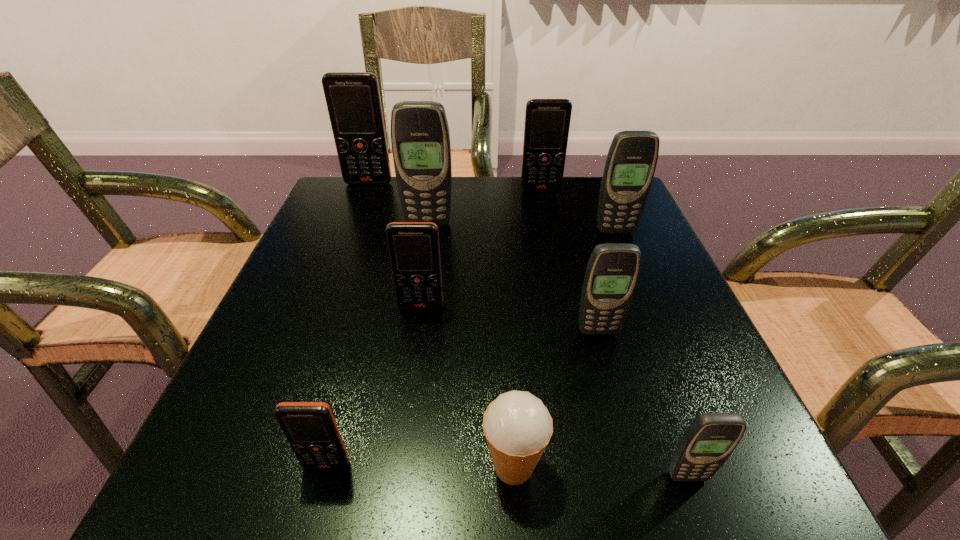
This screenshot has width=960, height=540. In order to click on blank space located on the screen of the fifth farthest object in this screenshot , I will do `click(397, 472)`.

Identify the location of blank space located 0.150m on the back of the icecream. The height and width of the screenshot is (540, 960). (507, 352).

In order to click on icecream present at the near edge in this screenshot , I will do `click(517, 426)`.

Identify the location of object that is at the far left corner. (353, 100).

This screenshot has height=540, width=960. I want to click on object that is at the near left corner, so click(x=310, y=427).

You are a GUI agent. You are given a task and a screenshot of the screen. Output one action in this format:
    pyautogui.click(x=<x>, y=<y>)
    Task: Click on the object present at the far right corner
    The image size is (960, 540).
    Given the screenshot: What is the action you would take?
    pyautogui.click(x=631, y=161)

This screenshot has height=540, width=960. I want to click on object situated at the near right corner, so click(x=710, y=439).

Find the location of `vacant space at the far edge of the desktop`. vacant space at the far edge of the desktop is located at coordinates (452, 212).

The width and height of the screenshot is (960, 540). In the image, there is a desktop. What are the coordinates of `vacant space at the near edge` in the screenshot? It's located at (630, 458).

Image resolution: width=960 pixels, height=540 pixels. Find the location of `vacant space at the left edge of the desktop`. vacant space at the left edge of the desktop is located at coordinates (248, 351).